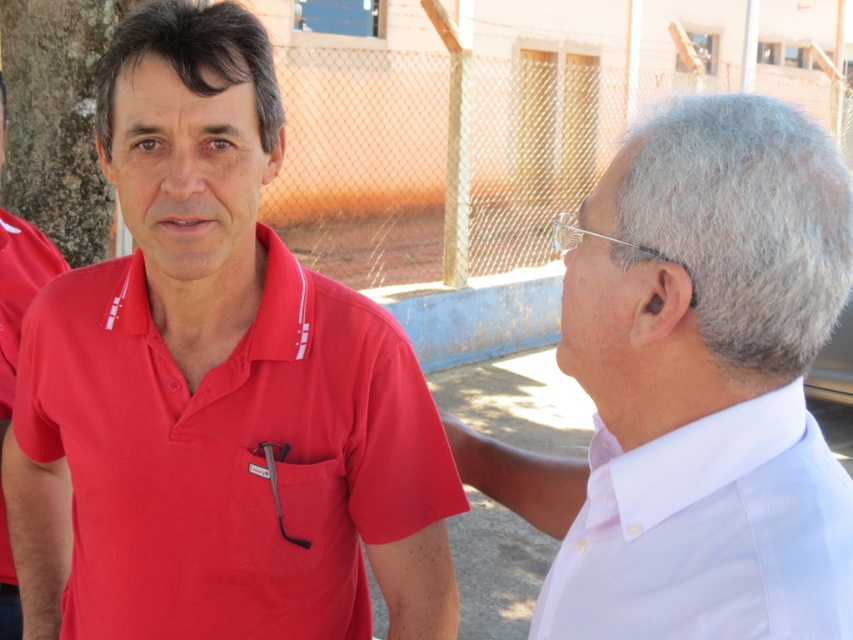
Question: Can you confirm if matte red polo shirt at left is positioned above matte red shirt at left?

Choices:
 (A) no
 (B) yes

Answer: (A)

Question: Is matte red polo shirt at left to the left of green rough bark at left from the viewer's perspective?

Choices:
 (A) no
 (B) yes

Answer: (A)

Question: Does green rough bark at left appear on the left side of matte red shirt at left?

Choices:
 (A) yes
 (B) no

Answer: (A)

Question: Estimate the real-world distances between objects in this image. Which object is closer to the matte red polo shirt at left?

Choices:
 (A) green rough bark at left
 (B) white glossy shirt at right

Answer: (B)

Question: Which point is farther to the camera?

Choices:
 (A) matte red shirt at left
 (B) green rough bark at left
 (C) white glossy shirt at right
 (D) matte red polo shirt at left

Answer: (B)

Question: Estimate the real-world distances between objects in this image. Which object is closer to the green rough bark at left?

Choices:
 (A) white glossy shirt at right
 (B) matte red shirt at left
 (C) matte red polo shirt at left

Answer: (B)